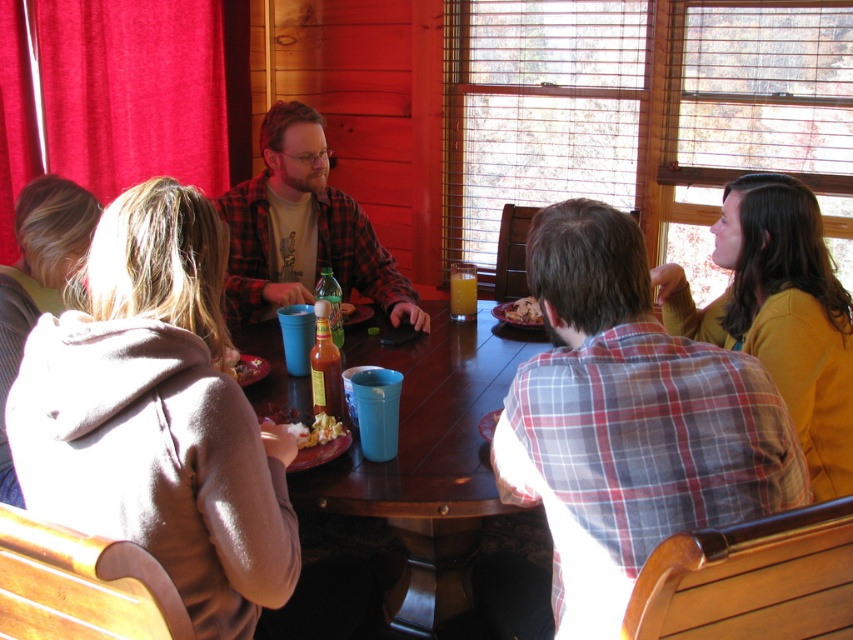
Can you confirm if plaid shirt at center is positioned above white crumbly bread at center?

Incorrect, plaid shirt at center is not positioned above white crumbly bread at center.

From the picture: Is plaid shirt at center below white crumbly bread at center?

Yes.

Locate an element on the screen. plaid shirt at center is located at coordinates (622, 432).

The height and width of the screenshot is (640, 853). Identify the location of plaid shirt at center. (622, 432).

Who is more forward, [329,504] or [541,316]?

Point [329,504] is in front.

Does blue plastic table at center have a smaller size compared to white crumbly bread at center?

No, blue plastic table at center is not smaller than white crumbly bread at center.

Identify the location of blue plastic table at center. (432, 467).

Can you confirm if plaid flannel shirt at center is taller than white popcorn at center?

Yes, plaid flannel shirt at center is taller than white popcorn at center.

Is point (390, 284) positioned behind point (264, 435)?

Yes, it is behind point (264, 435).

Identify the location of plaid flannel shirt at center. [x=303, y=228].